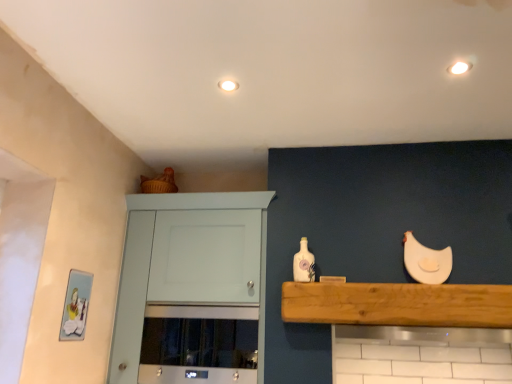
At what (x,y) coordinates should I click in order to perform the action: click on white matte light fixture at upper center, acting as the 2th lighting starting from the right. Please return your answer as a coordinate pair (x, y). The width and height of the screenshot is (512, 384). Looking at the image, I should click on (228, 85).

What is the approximate height of satin silver oven at center?

It is 16.06 inches.

The image size is (512, 384). Describe the element at coordinates (398, 304) in the screenshot. I see `wooden at upper center` at that location.

This screenshot has height=384, width=512. In order to click on white matte chicken at upper right in this screenshot , I will do `click(426, 261)`.

Where is `white matte light fixture at upper center, acting as the 2th lighting starting from the right`? This screenshot has width=512, height=384. white matte light fixture at upper center, acting as the 2th lighting starting from the right is located at coordinates (228, 85).

Is there a large distance between white glossy bottle at center and satin silver oven at center?

No, there isn't a large distance between white glossy bottle at center and satin silver oven at center.

Is white glossy bottle at center looking in the opposite direction of satin silver oven at center?

That's not correct — white glossy bottle at center is not looking away from satin silver oven at center.

In terms of size, does white glossy bottle at center appear bigger or smaller than satin silver oven at center?

Considering their sizes, white glossy bottle at center takes up less space than satin silver oven at center.

From a real-world perspective, which is physically below, white glossy bottle at center or satin silver oven at center?

In real-world perspective, satin silver oven at center is lower.

In the image, is satin silver oven at center positioned in front of or behind white painted wood cabinet at upper left?

Clearly, satin silver oven at center is behind white painted wood cabinet at upper left.

Is satin silver oven at center positioned far away from white painted wood cabinet at upper left?

satin silver oven at center is near white painted wood cabinet at upper left, not far away.

Is white painted wood cabinet at upper left at the back of satin silver oven at center?

Yes, satin silver oven at center is positioned with its back facing white painted wood cabinet at upper left.

From the image's perspective, relative to wooden at upper center, is white glossy light fixture at upper right, acting as the 1th lighting starting from the front, above or below?

From the image's perspective, white glossy light fixture at upper right, acting as the 1th lighting starting from the front, appears above wooden at upper center.

Is white glossy light fixture at upper right, positioned as the 2th lighting in left-to-right order, turned away from wooden at upper center?

white glossy light fixture at upper right, positioned as the 2th lighting in left-to-right order, does not have its back to wooden at upper center.

Considering the positions of objects white glossy light fixture at upper right, positioned as the 2th lighting in left-to-right order, and wooden at upper center in the image provided, who is behind, white glossy light fixture at upper right, positioned as the 2th lighting in left-to-right order, or wooden at upper center?

Positioned behind is wooden at upper center.

Considering the positions of objects white matte light fixture at upper center, which is the second lighting from front to back, and white glossy light fixture at upper right, acting as the 1th lighting starting from the front, in the image provided, who is more to the right, white matte light fixture at upper center, which is the second lighting from front to back, or white glossy light fixture at upper right, acting as the 1th lighting starting from the front,?

Positioned to the right is white glossy light fixture at upper right, acting as the 1th lighting starting from the front.

Would you say white matte light fixture at upper center, the 1th lighting viewed from the left, is outside white glossy light fixture at upper right, positioned as the 2th lighting in left-to-right order?

Yes, white matte light fixture at upper center, the 1th lighting viewed from the left, is located beyond the bounds of white glossy light fixture at upper right, positioned as the 2th lighting in left-to-right order.

Does white matte light fixture at upper center, placed as the first lighting when sorted from back to front, have a lesser height compared to white glossy light fixture at upper right, positioned as the 2th lighting in left-to-right order?

In fact, white matte light fixture at upper center, placed as the first lighting when sorted from back to front, may be taller than white glossy light fixture at upper right, positioned as the 2th lighting in left-to-right order.

You are a GUI agent. You are given a task and a screenshot of the screen. Output one action in this format:
    pyautogui.click(x=<x>, y=<y>)
    Task: Click on the lighting in front of the white matte light fixture at upper center, acting as the 2th lighting starting from the right
    This screenshot has height=384, width=512.
    Given the screenshot: What is the action you would take?
    pyautogui.click(x=459, y=68)

Is wooden at upper center located outside white matte chicken at upper right?

Yes, wooden at upper center is not within white matte chicken at upper right.

From a real-world perspective, is wooden at upper center over white matte chicken at upper right?

No, from a real-world perspective, wooden at upper center is not above white matte chicken at upper right.

In the scene shown: Can you confirm if wooden at upper center is positioned to the right of white matte chicken at upper right?

Incorrect, wooden at upper center is not on the right side of white matte chicken at upper right.

Consider the image. Is white matte chicken at upper right completely or partially outside of satin silver oven at center?

Yes, white matte chicken at upper right is located beyond the bounds of satin silver oven at center.

Considering the relative sizes of white matte chicken at upper right and satin silver oven at center in the image provided, is white matte chicken at upper right wider than satin silver oven at center?

No, white matte chicken at upper right is not wider than satin silver oven at center.

Is point (428, 250) closer or farther from the camera than point (205, 383)?

Point (428, 250) appears to be farther away from the viewer than point (205, 383).

Is white matte chicken at upper right to the left of satin silver oven at center from the viewer's perspective?

Incorrect, white matte chicken at upper right is not on the left side of satin silver oven at center.

Does point (394, 306) lie behind point (177, 304)?

No.

Find the location of a particular element. This screenshot has height=384, width=512. shelf that appears below the white painted wood cabinet at upper left (from a real-world perspective) is located at coordinates click(x=398, y=304).

Between wooden at upper center and white painted wood cabinet at upper left, which one has less height?

Standing shorter between the two is wooden at upper center.

Between wooden at upper center and white painted wood cabinet at upper left, which one has larger size?

white painted wood cabinet at upper left.

Locate an element on the screen. bottle above the satin silver oven at center (from the image's perspective) is located at coordinates (303, 263).

Locate an element on the screen. oven on the right of white painted wood cabinet at upper left is located at coordinates (199, 345).

From the image, which object appears to be nearer to white matte light fixture at upper center, the 1th lighting viewed from the left, satin silver oven at center or white painted wood cabinet at upper left?

Based on the image, white painted wood cabinet at upper left appears to be nearer to white matte light fixture at upper center, the 1th lighting viewed from the left.

Estimate the real-world distances between objects in this image. Which object is further from white painted wood cabinet at upper left, white glossy light fixture at upper right, acting as the 1th lighting starting from the front, or wooden at upper center?

white glossy light fixture at upper right, acting as the 1th lighting starting from the front, is further to white painted wood cabinet at upper left.

From the image, which object appears to be nearer to wooden at upper center, white glossy light fixture at upper right, positioned as the 2th lighting in left-to-right order, or white painted wood cabinet at upper left?

white painted wood cabinet at upper left.

Estimate the real-world distances between objects in this image. Which object is further from wooden at upper center, satin silver oven at center or white painted wood cabinet at upper left?

white painted wood cabinet at upper left is positioned further to the anchor wooden at upper center.

Which object lies nearer to the anchor point white matte chicken at upper right, white painted wood cabinet at upper left or white glossy bottle at center?

Based on the image, white glossy bottle at center appears to be nearer to white matte chicken at upper right.

Which object lies further to the anchor point white matte light fixture at upper center, the 1th lighting viewed from the left, white glossy light fixture at upper right, positioned as the 2th lighting in left-to-right order, or white matte chicken at upper right?

white matte chicken at upper right lies further to white matte light fixture at upper center, the 1th lighting viewed from the left, than the other object.

From the image, which object appears to be farther from white painted wood cabinet at upper left, white matte chicken at upper right or white glossy bottle at center?

white matte chicken at upper right.

Looking at the image, which one is located closer to white matte light fixture at upper center, acting as the 2th lighting starting from the right, wooden at upper center or white matte chicken at upper right?

Based on the image, wooden at upper center appears to be nearer to white matte light fixture at upper center, acting as the 2th lighting starting from the right.

Where is `chicken between white matte light fixture at upper center, placed as the first lighting when sorted from back to front, and satin silver oven at center, in the vertical direction`? The width and height of the screenshot is (512, 384). chicken between white matte light fixture at upper center, placed as the first lighting when sorted from back to front, and satin silver oven at center, in the vertical direction is located at coordinates tap(426, 261).

This screenshot has width=512, height=384. Find the location of `bottle situated between white painted wood cabinet at upper left and wooden at upper center from left to right`. bottle situated between white painted wood cabinet at upper left and wooden at upper center from left to right is located at coordinates (303, 263).

Image resolution: width=512 pixels, height=384 pixels. I want to click on lighting that lies between white glossy light fixture at upper right, positioned as the 2th lighting in left-to-right order, and white painted wood cabinet at upper left from top to bottom, so click(x=228, y=85).

At what (x,y) coordinates should I click in order to perform the action: click on oven located between white painted wood cabinet at upper left and white glossy bottle at center in the left-right direction. Please return your answer as a coordinate pair (x, y). The height and width of the screenshot is (384, 512). Looking at the image, I should click on (199, 345).